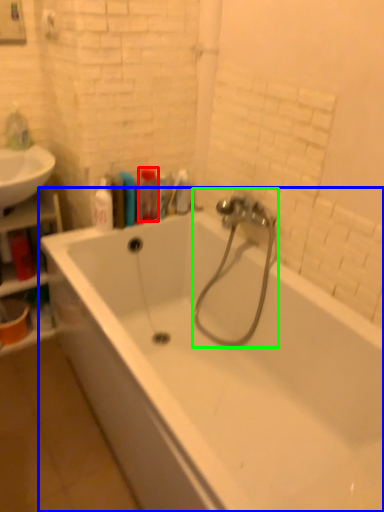
Question: Estimate the real-world distances between objects in this image. Which object is farther from toiletry (highlighted by a red box), bathtub (highlighted by a blue box) or garden hose (highlighted by a green box)?

Choices:
 (A) bathtub
 (B) garden hose

Answer: (A)